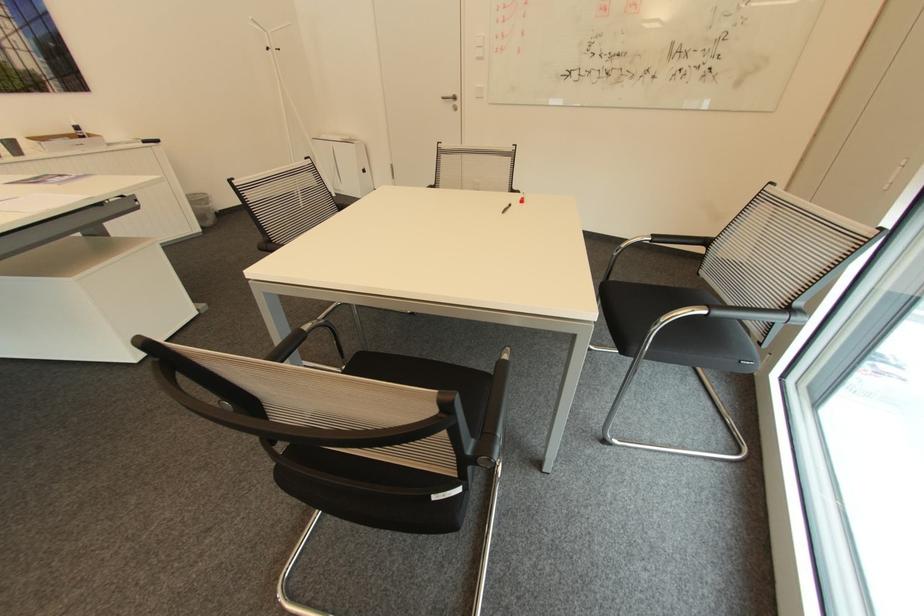
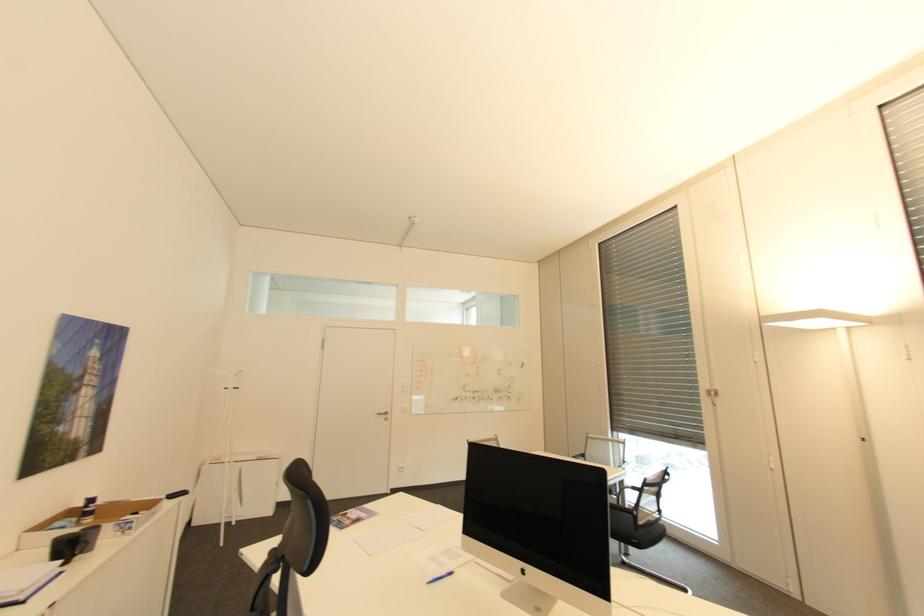
Where in the second image is the point corresponding to pixel 161 140 from the first image?

(188, 493)